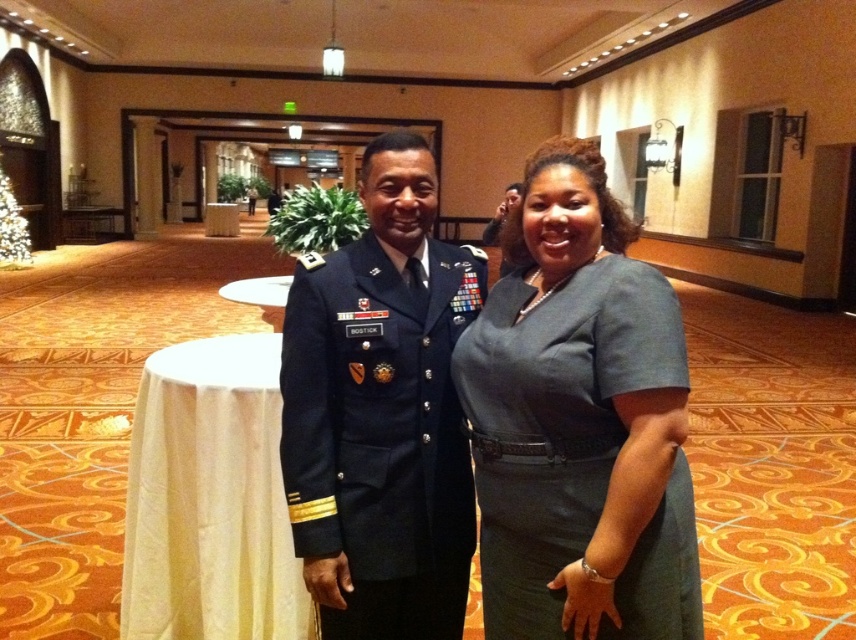
Question: Is navy blue fabric uniform at center above white cloth at left?

Choices:
 (A) yes
 (B) no

Answer: (A)

Question: Among these points, which one is farthest from the camera?

Choices:
 (A) (587, 460)
 (B) (402, 339)

Answer: (B)

Question: Does navy blue fabric uniform at center appear over white cloth at left?

Choices:
 (A) no
 (B) yes

Answer: (B)

Question: Where is matte gray dress at center located in relation to white cloth at left in the image?

Choices:
 (A) above
 (B) below

Answer: (A)

Question: Which point is farther to the camera?

Choices:
 (A) white cloth at left
 (B) navy blue fabric uniform at center
 (C) matte gray dress at center

Answer: (A)

Question: Which object is farther from the camera taking this photo?

Choices:
 (A) matte gray dress at center
 (B) navy blue fabric uniform at center
 (C) white cloth at left

Answer: (C)